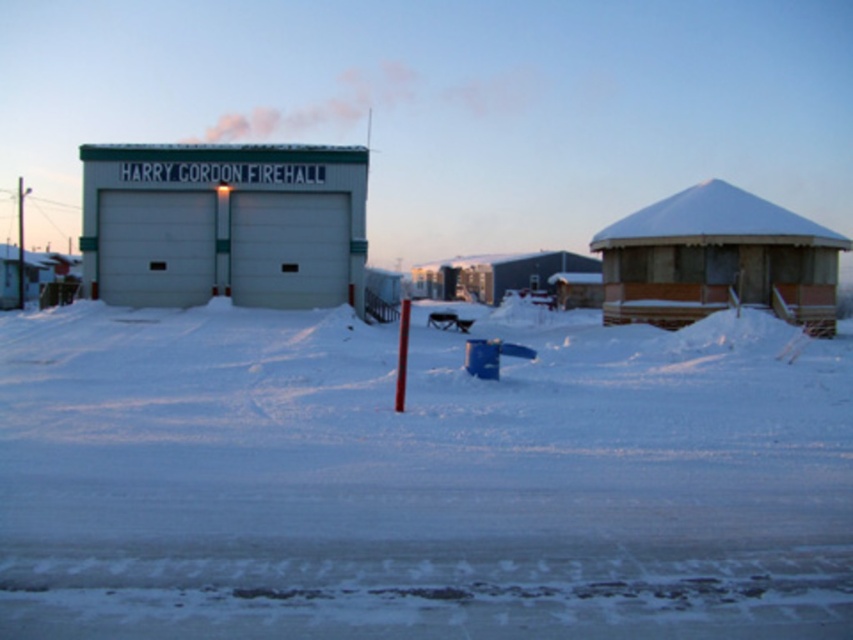
You are planning to build a snowman using the white powdery snow at center and the white matte firehall at center. Which material would be more suitable for building the snowman?

The white powdery snow at center is bigger than the white matte firehall at center, so it would be more suitable for building a snowman as it provides a larger quantity of snow.

You are standing at the entrance of the HARRY GORDON FIREHALL and want to walk to the smaller building to the right. Is the path between the two buildings covered in white powdery snow at center?

The white powdery snow at center is located at point coordinates (419, 477). Since the path between the two buildings would be near the center of the image, it is likely covered in white powdery snow at center.

You are planning to build a snowman using the white powdery snow at center. Considering the wooden cabin at right is nearby, will there be enough space between them to build the snowman?

The white powdery snow at center is not as tall as the wooden cabin at right, so there should be sufficient space between them to build a snowman.